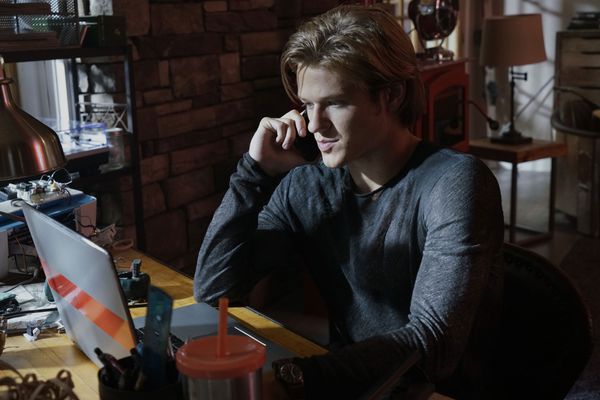
In order to click on lamp base in this screenshot , I will do `click(516, 137)`.